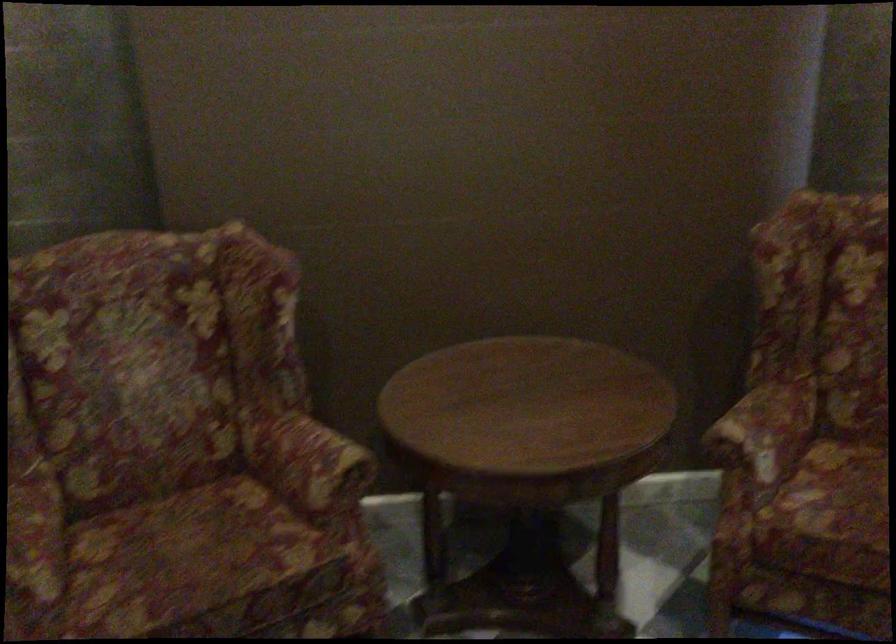
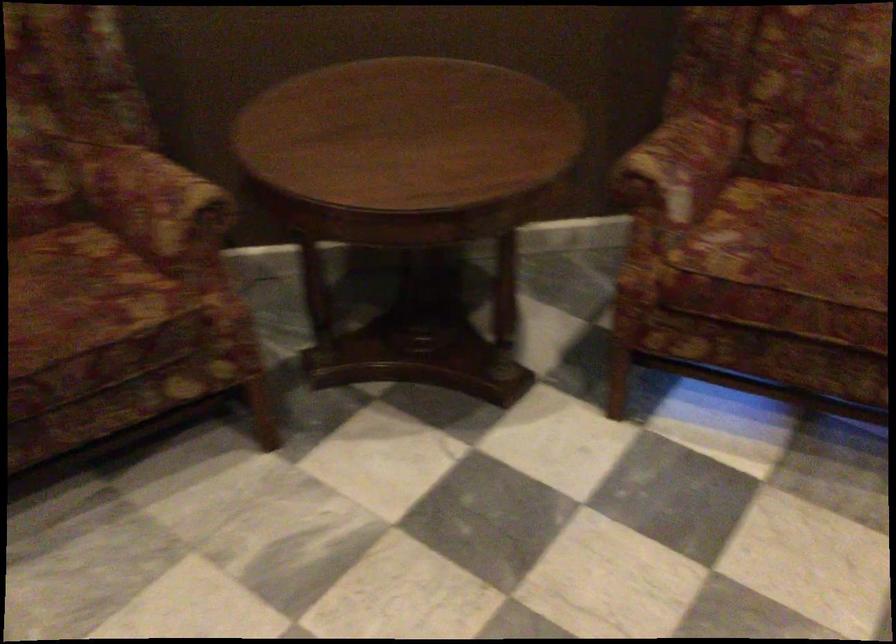
Find the pixel in the second image that matches (240,540) in the first image.

(80, 292)